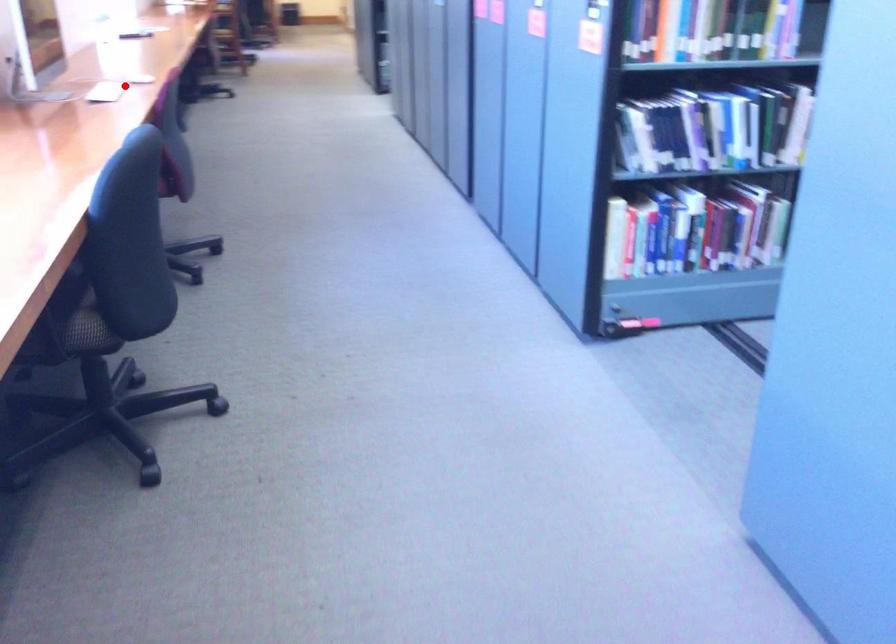
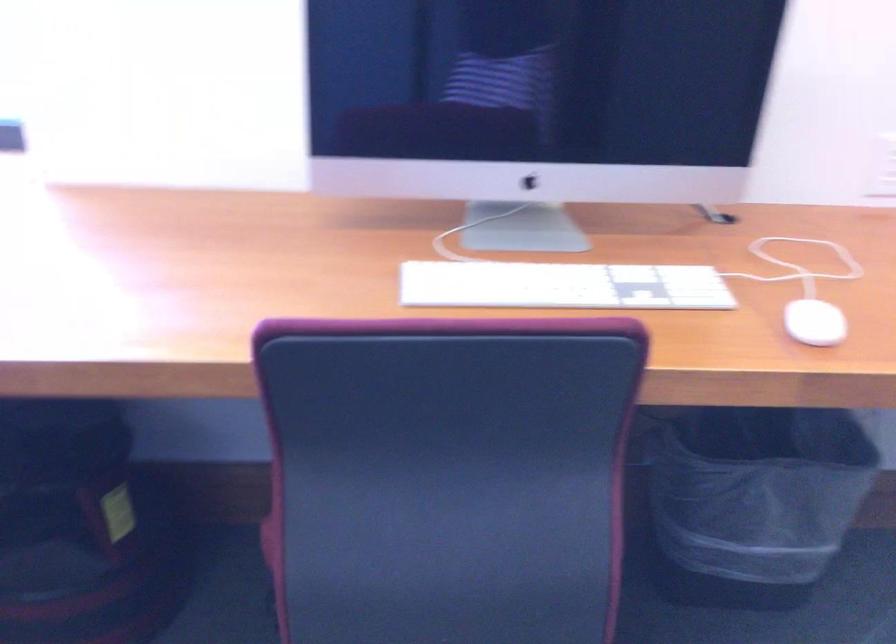
Question: I am providing you with two images of the same scene from different viewpoints. Given a red point in image1, look at the same physical point in image2. Is it:

Choices:
 (A) Closer to the viewpoint
 (B) Farther from the viewpoint

Answer: (A)